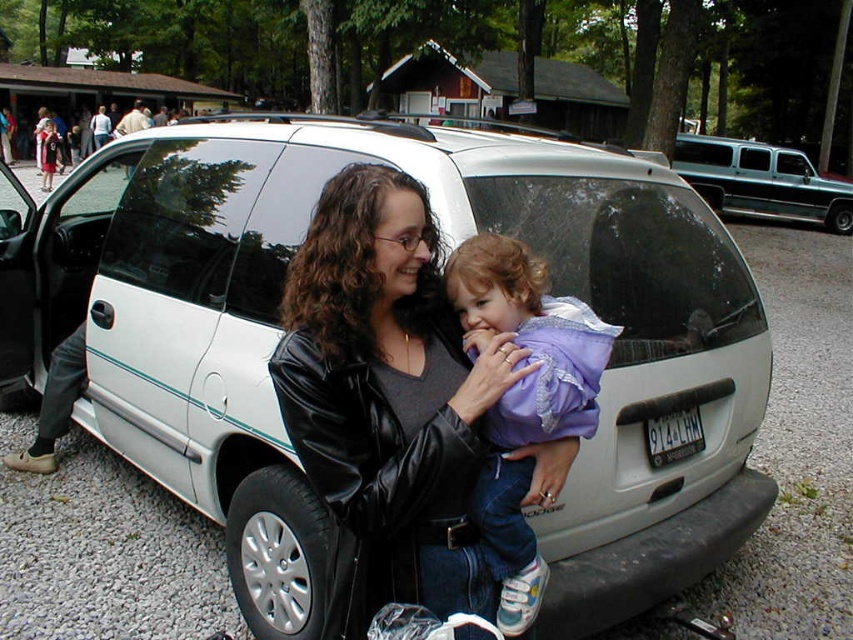
Question: Which point is farther from the camera taking this photo?

Choices:
 (A) (47, 186)
 (B) (555, 323)

Answer: (A)

Question: Estimate the real-world distances between objects in this image. Which object is closer to the white matte van at center?

Choices:
 (A) purple fleece jacket at center
 (B) black leather jacket at center

Answer: (B)

Question: Is black leather jacket at center above teal metallic van at right?

Choices:
 (A) yes
 (B) no

Answer: (B)

Question: Is black leather jacket at center in front of matte black dress at center?

Choices:
 (A) yes
 (B) no

Answer: (A)

Question: Which object is positioned farthest from the purple fleece jacket at center?

Choices:
 (A) black leather jacket at center
 (B) teal metallic van at right

Answer: (B)

Question: Is black leather jacket at center further to the viewer compared to teal metallic van at right?

Choices:
 (A) no
 (B) yes

Answer: (A)